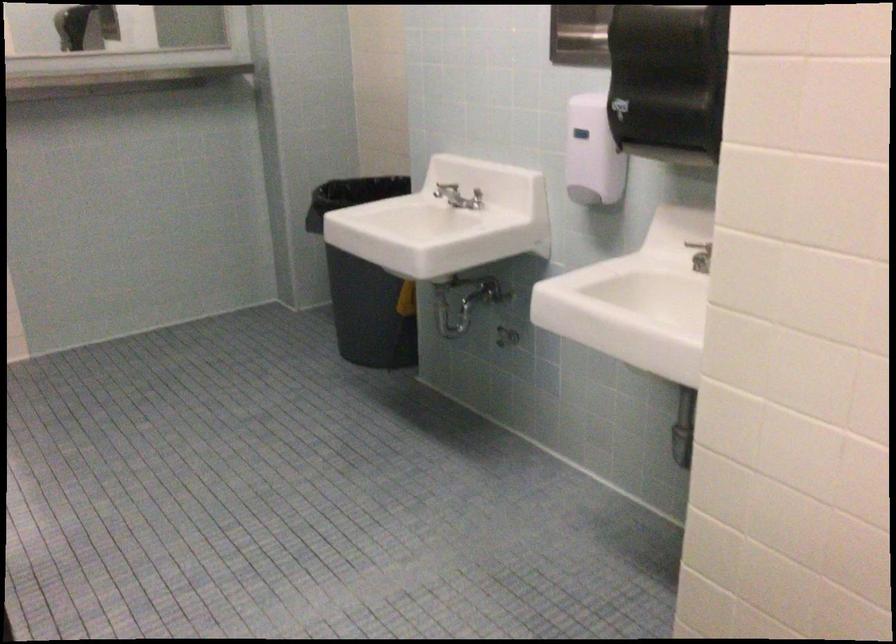
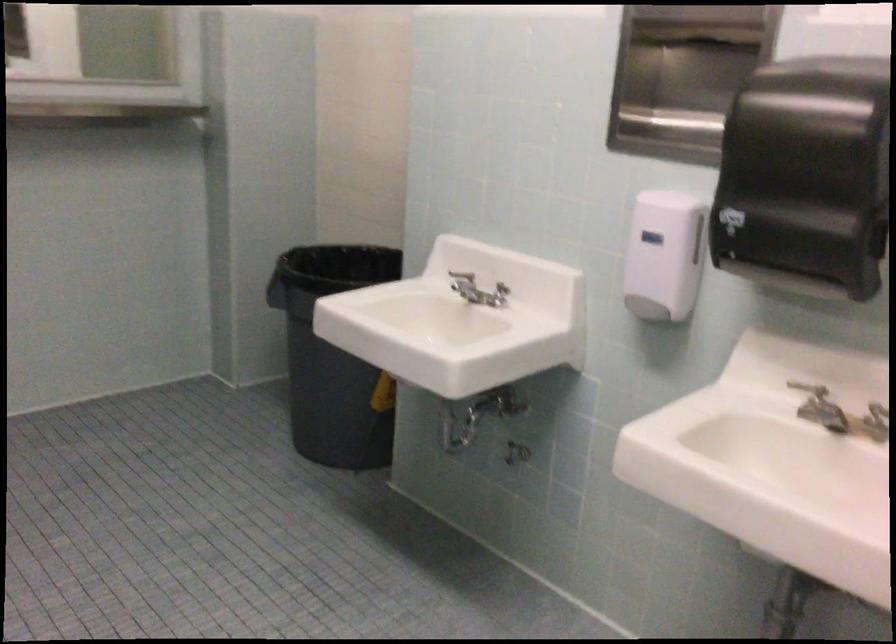
Question: Based on the continuous images, in which direction is the camera rotating? Reply with the corresponding letter.

Choices:
 (A) Left
 (B) Right
 (C) Up
 (D) Down

Answer: (B)